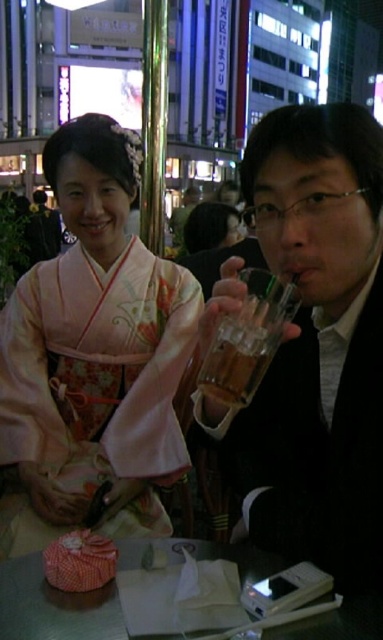
Can you confirm if clear glass cup at right is shorter than translucent glass cup at upper center?

No, clear glass cup at right is not shorter than translucent glass cup at upper center.

Is clear glass cup at right above translucent glass cup at upper center?

Yes.

Is point (381, 298) positioned behind point (258, 372)?

Yes.

The image size is (383, 640). Identify the location of clear glass cup at right. (310, 340).

Between metallic silver phone at lower center and translucent glass cup at upper center, which one is positioned higher?

translucent glass cup at upper center

Identify the location of metallic silver phone at lower center. (54, 605).

Who is more distant from viewer, (122,637) or (242,356)?

The point (242,356) is behind.

You are a GUI agent. You are given a task and a screenshot of the screen. Output one action in this format:
    pyautogui.click(x=<x>, y=<y>)
    Task: Click on the metallic silver phone at lower center
    This screenshot has height=640, width=383.
    Given the screenshot: What is the action you would take?
    pyautogui.click(x=54, y=605)

Does clear glass cup at right have a smaller size compared to metallic silver phone at lower center?

No, clear glass cup at right is not smaller than metallic silver phone at lower center.

What do you see at coordinates (310, 340) in the screenshot? I see `clear glass cup at right` at bounding box center [310, 340].

Does point (286, 182) come behind point (112, 602)?

Yes, it is.

The image size is (383, 640). Find the location of `clear glass cup at right`. clear glass cup at right is located at coordinates (310, 340).